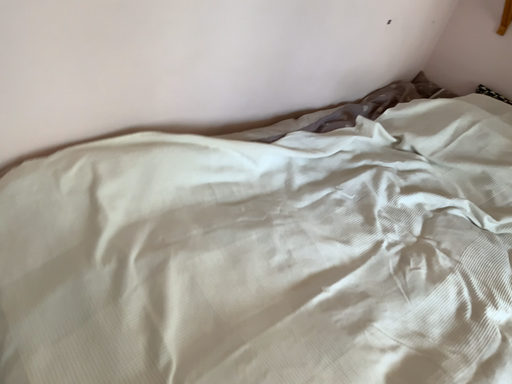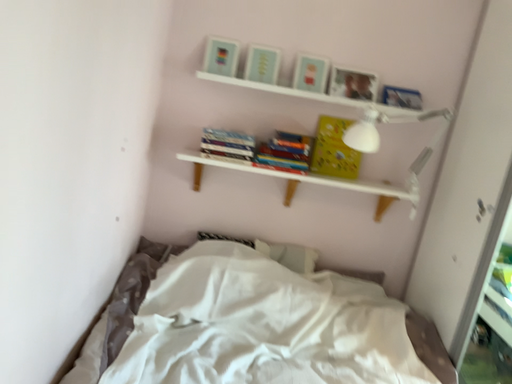
Question: How did the camera likely rotate when shooting the video?

Choices:
 (A) rotated right
 (B) rotated left

Answer: (A)